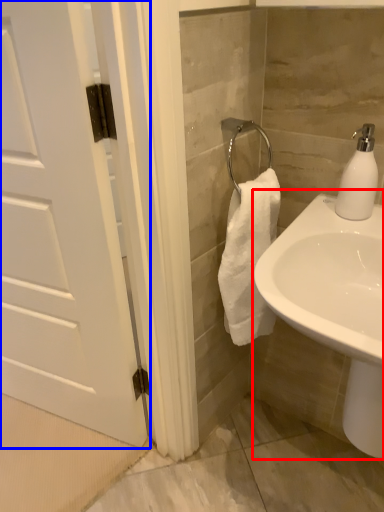
Question: Which object appears closest to the camera in this image, sink (highlighted by a red box) or door (highlighted by a blue box)?

Choices:
 (A) sink
 (B) door

Answer: (A)